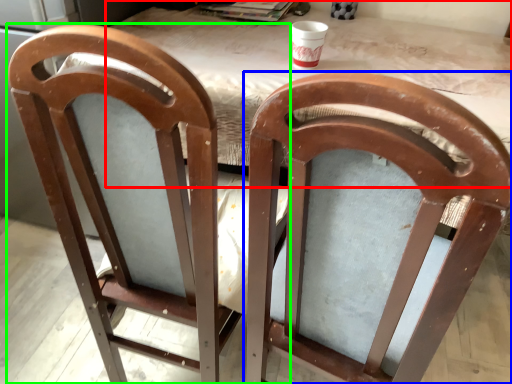
Question: Estimate the real-world distances between objects in this image. Which object is farther from table (highlighted by a red box), chair (highlighted by a blue box) or chair (highlighted by a green box)?

Choices:
 (A) chair
 (B) chair

Answer: (B)